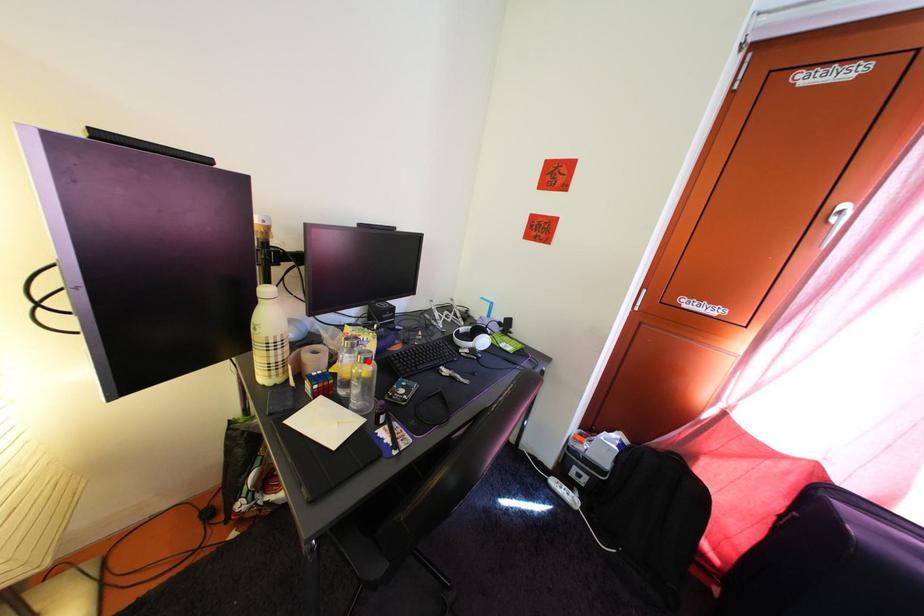
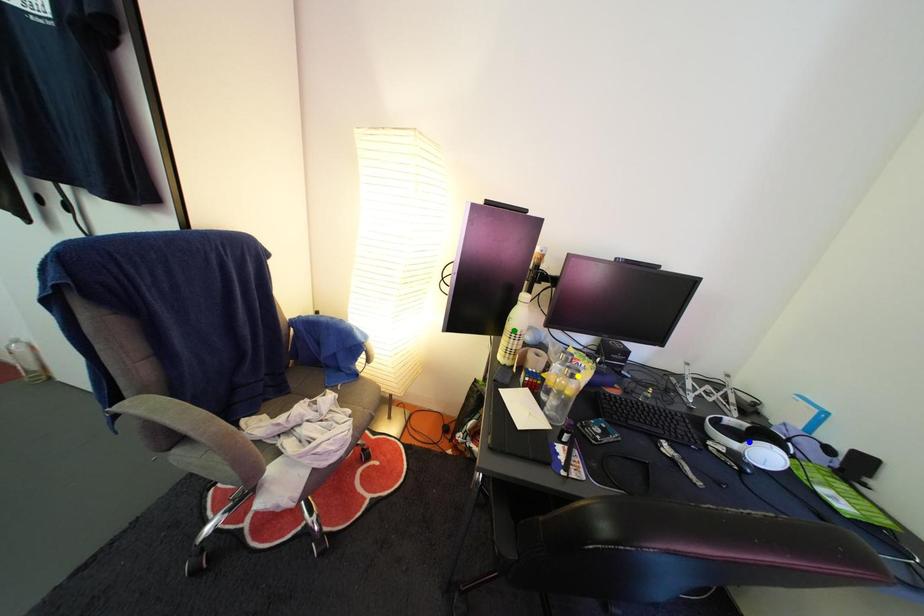
Question: I am providing you with two images of the same scene from different viewpoints. A red point is marked on the first image. You are given multiple points on the second image. Which spot in image 2 lines up with the point in image 1?

Choices:
 (A) green point
 (B) yellow point
 (C) blue point

Answer: (B)